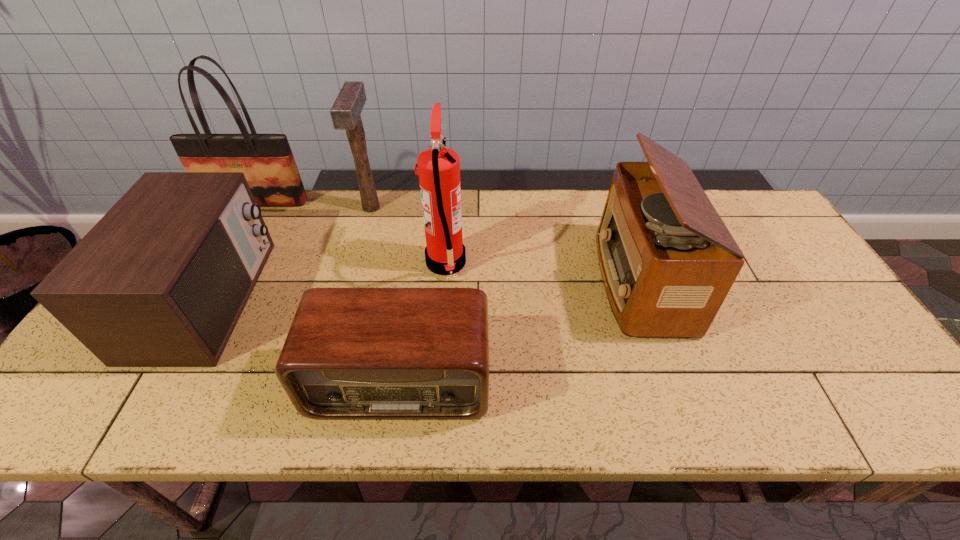
You are a GUI agent. You are given a task and a screenshot of the screen. Output one action in this format:
    pyautogui.click(x=<x>, y=<y>)
    Task: Click on the object located at the near edge
    The height and width of the screenshot is (540, 960).
    Given the screenshot: What is the action you would take?
    pyautogui.click(x=351, y=353)

Image resolution: width=960 pixels, height=540 pixels. I want to click on shopping bag situated at the left edge, so click(x=266, y=160).

I want to click on radio receiver positioned at the left edge, so click(161, 280).

The width and height of the screenshot is (960, 540). What are the coordinates of `object that is positioned at the far left corner` in the screenshot? It's located at (266, 160).

Locate an element on the screen. free spot at the far edge of the desktop is located at coordinates (528, 210).

This screenshot has width=960, height=540. Find the location of `vacant space at the near edge`. vacant space at the near edge is located at coordinates (535, 408).

Image resolution: width=960 pixels, height=540 pixels. I want to click on free space at the left edge of the desktop, so click(64, 386).

Identify the location of free space at the near left corner of the desktop. The image size is (960, 540). (119, 407).

Identify the location of free space between the second radio receiver from right to left and the tallest radio receiver. This screenshot has height=540, width=960. (520, 331).

The height and width of the screenshot is (540, 960). Identify the location of free space between the rightmost radio receiver and the mallet. (506, 245).